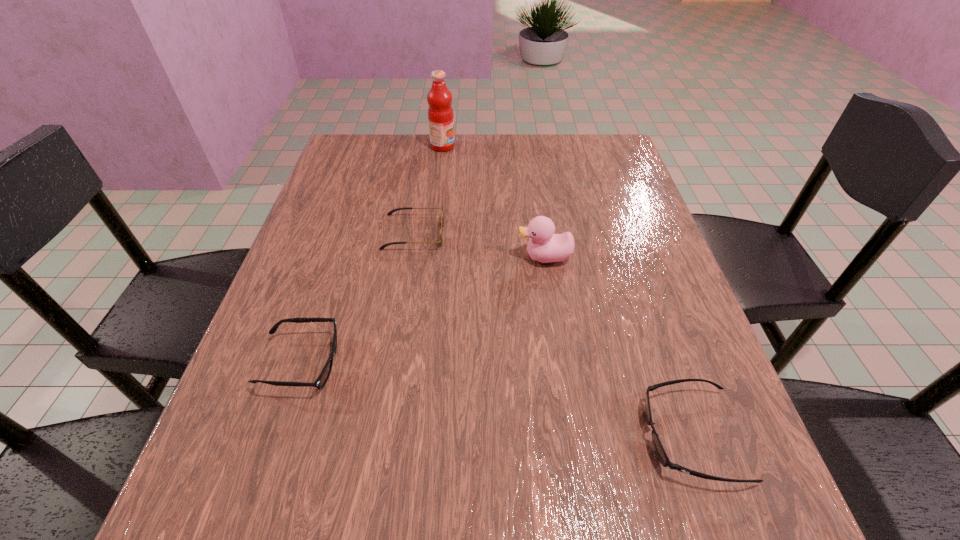
Where is `unoccupied position between the fruit juice and the rightmost sunglasses`? unoccupied position between the fruit juice and the rightmost sunglasses is located at coordinates (567, 291).

The image size is (960, 540). I want to click on empty location between the fourth shortest object and the farthest object, so click(x=493, y=202).

At what (x,y) coordinates should I click in order to perform the action: click on empty space that is in between the second object from right to left and the second sunglasses from left to right. Please return your answer as a coordinate pair (x, y). Looking at the image, I should click on (479, 245).

Locate an element on the screen. vacant area that lies between the rightmost sunglasses and the tallest object is located at coordinates (567, 291).

You are a GUI agent. You are given a task and a screenshot of the screen. Output one action in this format:
    pyautogui.click(x=<x>, y=<y>)
    Task: Click on the vacant area that lies between the second sunglasses from right to left and the tallest object
    This screenshot has height=540, width=960.
    Given the screenshot: What is the action you would take?
    pyautogui.click(x=428, y=190)

The image size is (960, 540). I want to click on unoccupied position between the fourth shortest object and the rightmost object, so click(618, 346).

I want to click on free space between the fourth shortest object and the leftmost object, so click(423, 310).

This screenshot has width=960, height=540. I want to click on object that ranks as the fourth closest to the second sunglasses from left to right, so click(x=659, y=450).

This screenshot has height=540, width=960. I want to click on object that is the third closest one to the rightmost sunglasses, so click(322, 379).

Locate which sunglasses is the second closest to the leftmost sunglasses. Please provide its 2D coordinates. Your answer should be formatted as a tuple, i.e. [(x, y)], where the tuple contains the x and y coordinates of a point satisfying the conditions above.

[(659, 450)]